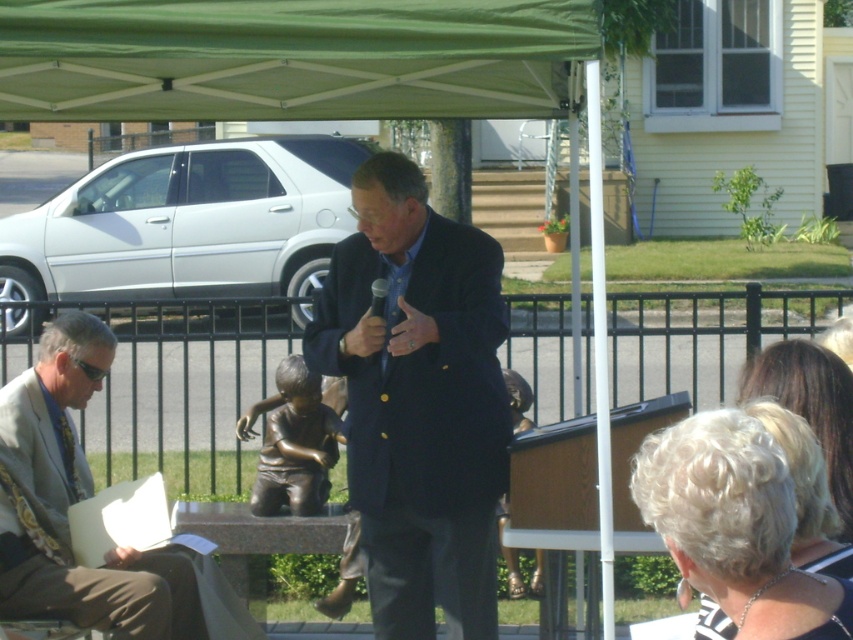
Is point (422, 301) positioned behind point (100, 364)?

That is False.

Is dark blue suit at center further to camera compared to gray suit at left?

That is False.

Which is behind, point (395, 608) or point (51, 362)?

The point (51, 362) is more distant.

Where is `dark blue suit at center`? The image size is (853, 640). dark blue suit at center is located at coordinates (418, 401).